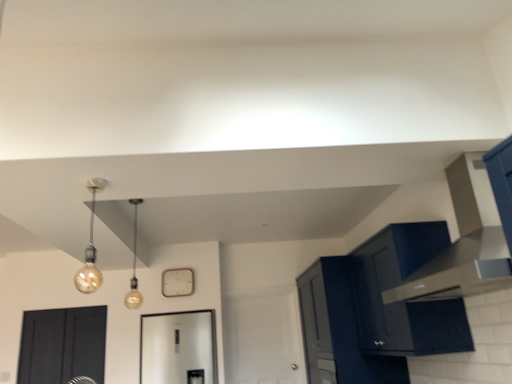
Question: Considering the relative positions of matte black vent at upper right and matte gold bulb at upper left, the 2th light fixture positioned from the back, in the image provided, is matte black vent at upper right to the left of matte gold bulb at upper left, the 2th light fixture positioned from the back, from the viewer's perspective?

Choices:
 (A) no
 (B) yes

Answer: (A)

Question: Does matte black vent at upper right have a greater width compared to matte gold bulb at upper left, placed as the first light fixture when sorted from front to back?

Choices:
 (A) yes
 (B) no

Answer: (A)

Question: Could you tell me if matte black vent at upper right is facing matte gold bulb at upper left, the 2th light fixture positioned from the back?

Choices:
 (A) yes
 (B) no

Answer: (A)

Question: Considering the relative sizes of matte black vent at upper right and matte gold bulb at upper left, placed as the first light fixture when sorted from front to back, in the image provided, is matte black vent at upper right shorter than matte gold bulb at upper left, placed as the first light fixture when sorted from front to back,?

Choices:
 (A) yes
 (B) no

Answer: (B)

Question: From a real-world perspective, does matte black vent at upper right stand above matte gold bulb at upper left, placed as the first light fixture when sorted from front to back?

Choices:
 (A) yes
 (B) no

Answer: (B)

Question: Based on their sizes in the image, would you say matte glass bulb at center, which is counted as the first light fixture, starting from the back, is bigger or smaller than matte dark blue cabinet at upper right, the second cabinetry viewed from the front?

Choices:
 (A) big
 (B) small

Answer: (B)

Question: Is point 133,266 closer or farther from the camera than point 332,276?

Choices:
 (A) closer
 (B) farther

Answer: (B)

Question: Visually, is matte glass bulb at center, marked as the 2th light fixture in a front-to-back arrangement, positioned to the left or to the right of matte dark blue cabinet at upper right, the second cabinetry viewed from the front?

Choices:
 (A) left
 (B) right

Answer: (A)

Question: Considering their positions, is matte glass bulb at center, marked as the 2th light fixture in a front-to-back arrangement, located in front of or behind matte dark blue cabinet at upper right, which is the 1th cabinetry from back to front?

Choices:
 (A) front
 (B) behind

Answer: (A)

Question: Considering their positions, is matte gold bulb at upper left, placed as the first light fixture when sorted from front to back, located in front of or behind matte black vent at upper right?

Choices:
 (A) behind
 (B) front

Answer: (A)

Question: From a real-world perspective, is matte gold bulb at upper left, placed as the first light fixture when sorted from front to back, physically located above or below matte black vent at upper right?

Choices:
 (A) above
 (B) below

Answer: (A)

Question: Based on their positions, is matte gold bulb at upper left, the 2th light fixture positioned from the back, located to the left or right of matte black vent at upper right?

Choices:
 (A) right
 (B) left

Answer: (B)

Question: Is matte gold bulb at upper left, the 2th light fixture positioned from the back, inside the boundaries of matte black vent at upper right, or outside?

Choices:
 (A) outside
 (B) inside

Answer: (A)

Question: Considering the positions of matte glass bulb at center, marked as the 2th light fixture in a front-to-back arrangement, and matte gold bulb at upper left, the 2th light fixture positioned from the back, in the image, is matte glass bulb at center, marked as the 2th light fixture in a front-to-back arrangement, taller or shorter than matte gold bulb at upper left, the 2th light fixture positioned from the back,?

Choices:
 (A) tall
 (B) short

Answer: (A)

Question: Is matte glass bulb at center, which is counted as the first light fixture, starting from the back, to the left or to the right of matte gold bulb at upper left, the 2th light fixture positioned from the back, in the image?

Choices:
 (A) right
 (B) left

Answer: (B)